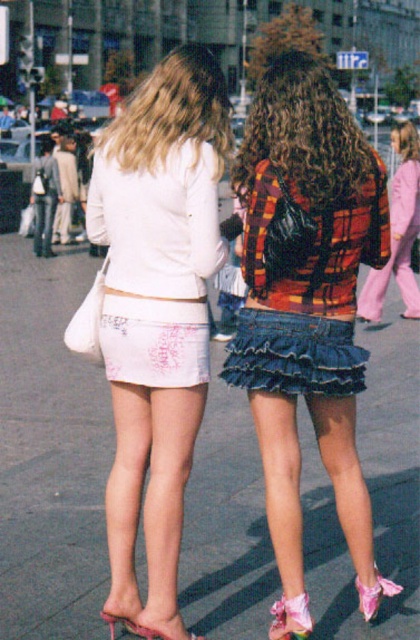
Which is in front, point (270, 298) or point (149, 243)?

Point (149, 243)

At what (x,y) coordinates should I click in order to perform the action: click on denim skirt at center. Please return your answer as a coordinate pair (x, y). The image size is (420, 640). Looking at the image, I should click on (306, 296).

Identify the location of denim skirt at center. The image size is (420, 640). (306, 296).

Between denim skirt at center and blonde hair at upper center, which one has more height?

Standing taller between the two is denim skirt at center.

Who is lower down, denim skirt at center or blonde hair at upper center?

Positioned lower is denim skirt at center.

The height and width of the screenshot is (640, 420). I want to click on denim skirt at center, so click(306, 296).

Identify the location of denim skirt at center. (306, 296).

Does denim frill skirt at center have a lesser width compared to pink satin heel at lower right?

Incorrect, denim frill skirt at center's width is not less than pink satin heel at lower right's.

Is denim frill skirt at center in front of pink satin heel at lower right?

Yes, it is in front of pink satin heel at lower right.

Which is behind, point (349, 385) or point (375, 572)?

Positioned behind is point (375, 572).

The width and height of the screenshot is (420, 640). I want to click on denim frill skirt at center, so click(x=294, y=355).